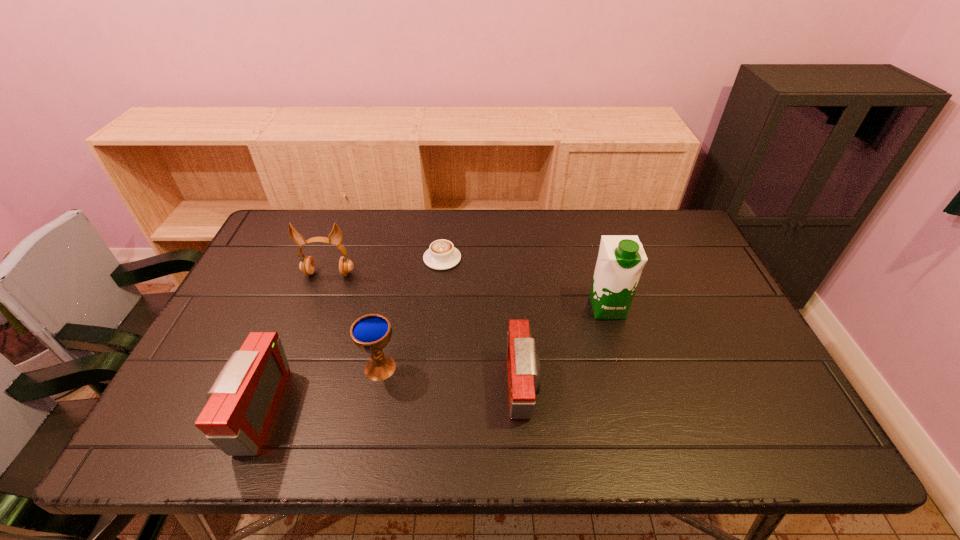
At what (x,y) coordinates should I click in order to perform the action: click on free space between the fourth object from left to right and the fourth nearest object. Please return your answer as a coordinate pair (x, y). Looking at the image, I should click on (525, 283).

Where is `free space between the chalice and the taller camera`? This screenshot has height=540, width=960. free space between the chalice and the taller camera is located at coordinates (319, 389).

Identify the location of vacant space in between the cappuccino and the left camera. The image size is (960, 540). (349, 335).

Image resolution: width=960 pixels, height=540 pixels. What are the coordinates of `vacant space that's between the right camera and the shortest object` in the screenshot? It's located at (483, 323).

Identify the location of unoccupied position between the fourth object from left to right and the earphone. This screenshot has height=540, width=960. (386, 266).

The image size is (960, 540). Identify the location of free space between the fifth shortest object and the shortest object. (386, 266).

At what (x,y) coordinates should I click in order to perform the action: click on vacant area that lies between the right camera and the second tallest object. Please return your answer as a coordinate pair (x, y). Image resolution: width=960 pixels, height=540 pixels. Looking at the image, I should click on (426, 330).

This screenshot has width=960, height=540. In order to click on vacant area that lies between the fifth shortest object and the chalice in this screenshot , I will do click(x=354, y=321).

In order to click on empty location between the shortest object and the second tallest object in this screenshot , I will do `click(386, 266)`.

Identify which object is the nearest to the second tallest object. Please provide its 2D coordinates. Your answer should be formatted as a tuple, i.e. [(x, y)], where the tuple contains the x and y coordinates of a point satisfying the conditions above.

[(442, 255)]